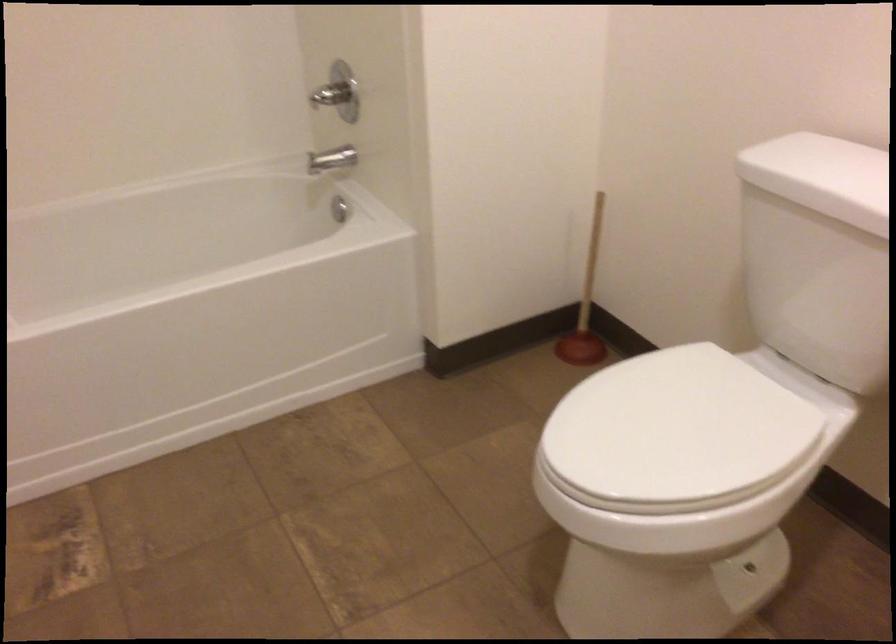
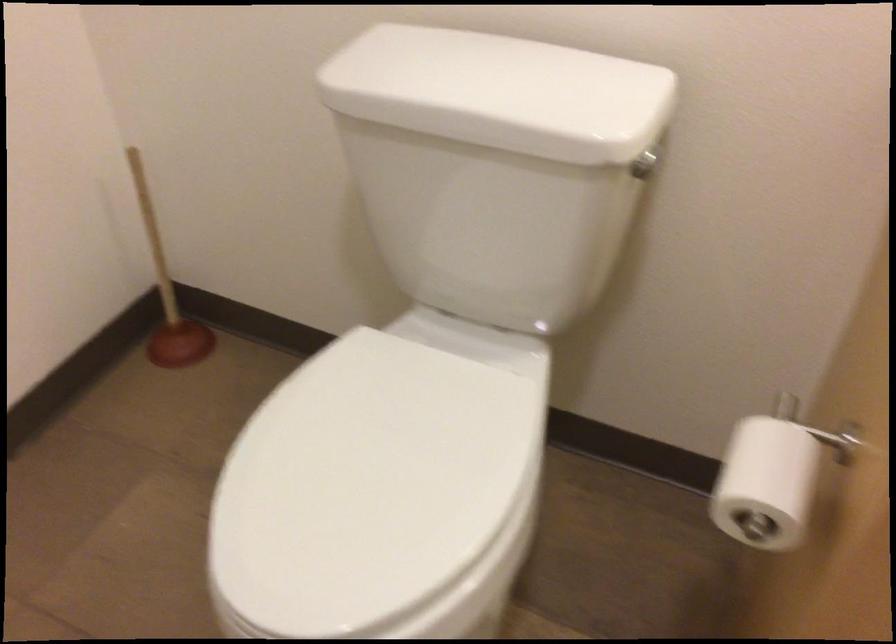
Find the pixel in the second image that matches point (672, 442) in the first image.

(376, 496)